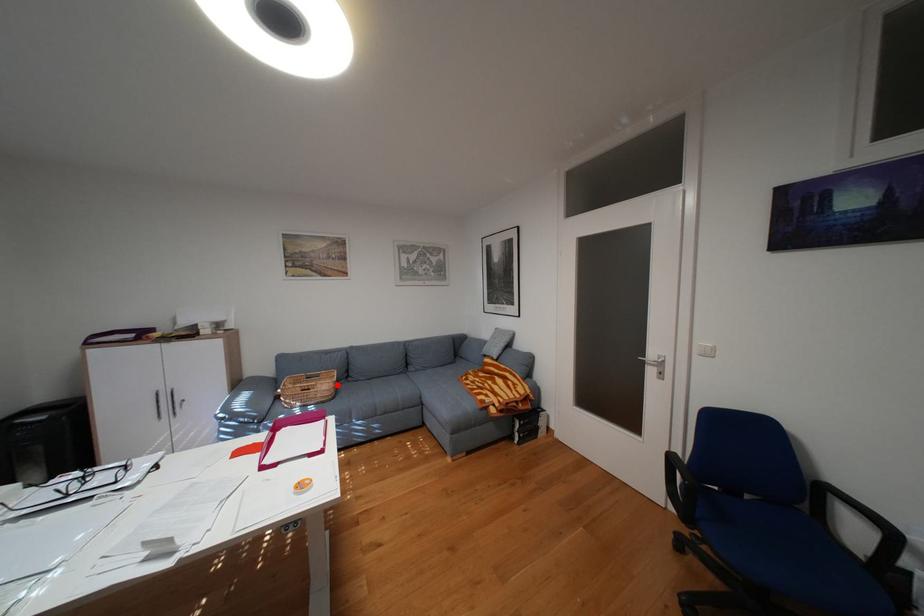
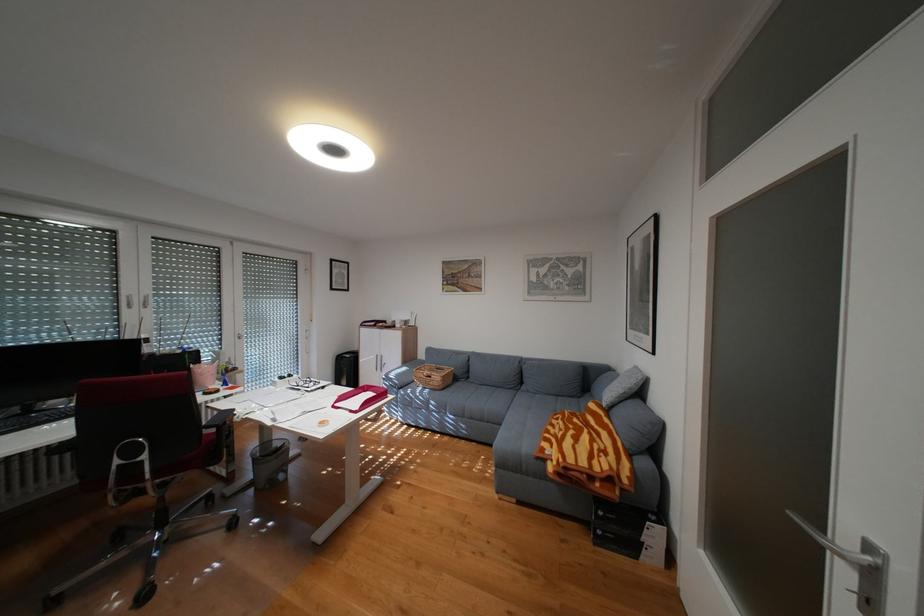
Question: I am providing you with two images of the same scene from different viewpoints. Image1 has a red point marked. In image2, the corresponding 3D location appears at what relative position? Reply with the corresponding letter.

Choices:
 (A) Closer
 (B) Farther

Answer: (B)